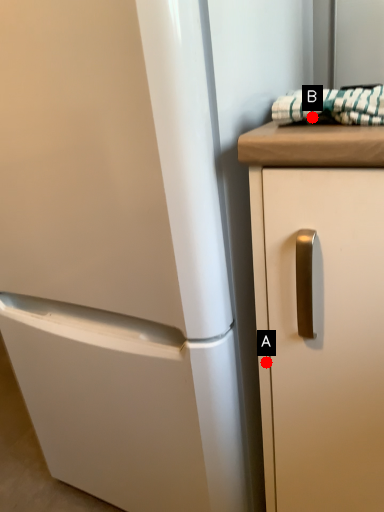
Question: Two points are circled on the image, labeled by A and B beside each circle. Which point is closer to the camera?

Choices:
 (A) A is closer
 (B) B is closer

Answer: (B)